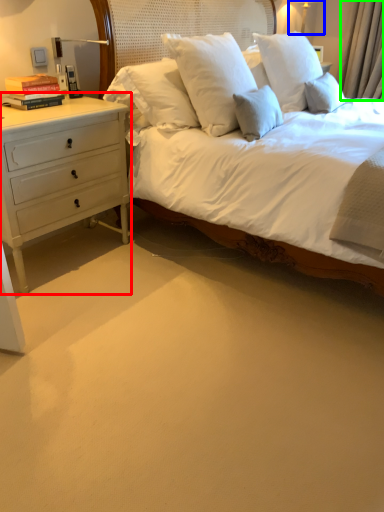
Question: Based on their relative distances, which object is nearer to chest of drawers (highlighted by a red box)? Choose from bedside lamp (highlighted by a blue box) and curtain (highlighted by a green box).

Choices:
 (A) bedside lamp
 (B) curtain

Answer: (B)